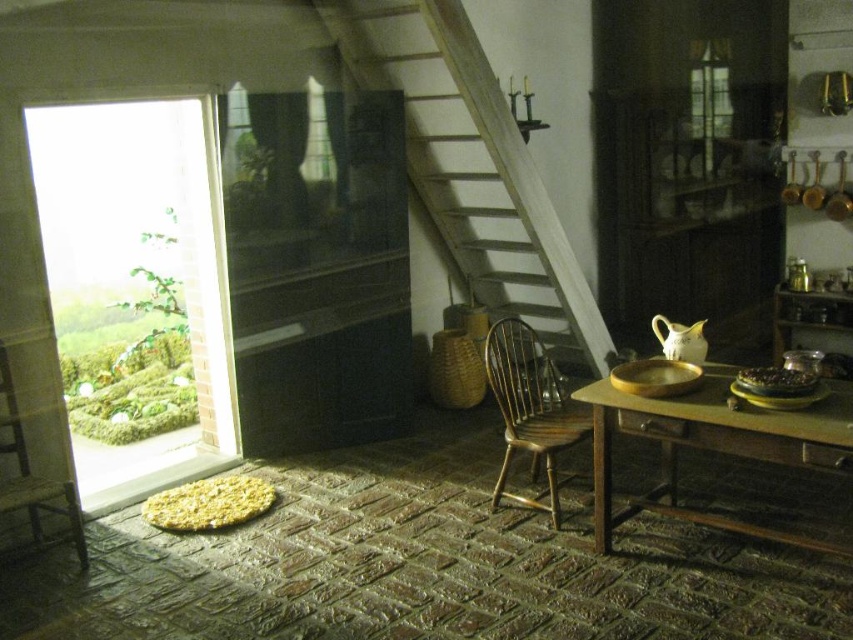
Question: Which point appears farthest from the camera in this image?

Choices:
 (A) (570, 349)
 (B) (592, 406)
 (C) (42, 534)

Answer: (A)

Question: Does wooden stairs at center lie behind wooden chair at center?

Choices:
 (A) yes
 (B) no

Answer: (A)

Question: Is wooden stairs at center bigger than wooden chair at center?

Choices:
 (A) no
 (B) yes

Answer: (B)

Question: Considering the real-world distances, which object is closest to the wooden chair at left?

Choices:
 (A) wooden table at lower right
 (B) wooden chair at center
 (C) wooden stairs at center

Answer: (B)

Question: Estimate the real-world distances between objects in this image. Which object is farther from the wooden chair at left?

Choices:
 (A) wooden stairs at center
 (B) wooden chair at center

Answer: (A)

Question: From the image, what is the correct spatial relationship of wooden table at lower right in relation to wooden chair at center?

Choices:
 (A) below
 (B) above

Answer: (A)